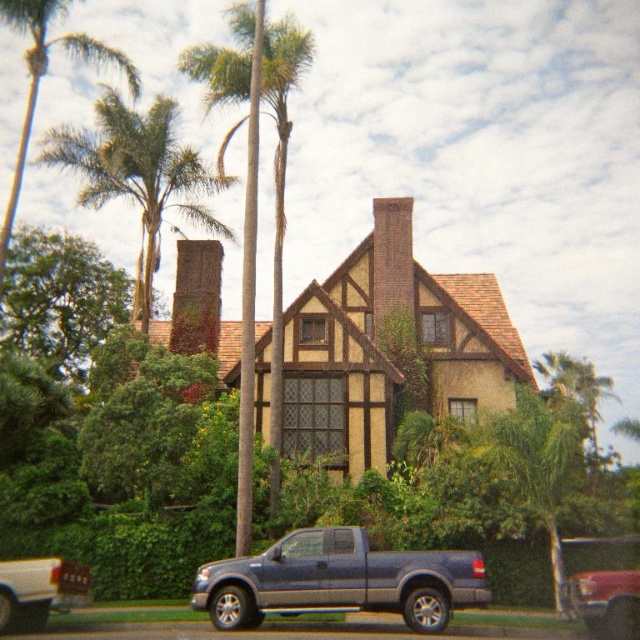
You are a photographer planning to take a picture of the house. You want to ensure both the green leafy palm tree at center and the white matte truck at lower left are visible in the frame. Considering their sizes, which object will occupy more space in the photo?

The green leafy palm tree at center will occupy more space in the photo since it has a larger size compared to the white matte truck at lower left.

You are standing in front of the Tudor house and want to take a photo of the two green leafy palm trees. Which palm tree, the green leafy palm tree at center or the green leafy palm tree at upper center, is closer to you?

The green leafy palm tree at center is closer to you because it is in front of the green leafy palm tree at upper center.

You are standing in front of the Tudor house and want to take a photo of the green leafy palm tree at center. Based on its coordinates, where should you position yourself to capture it in the frame?

The green leafy palm tree at center is located at coordinates point (256, 198), so you should position yourself directly in front of the Tudor house to capture it in the frame.